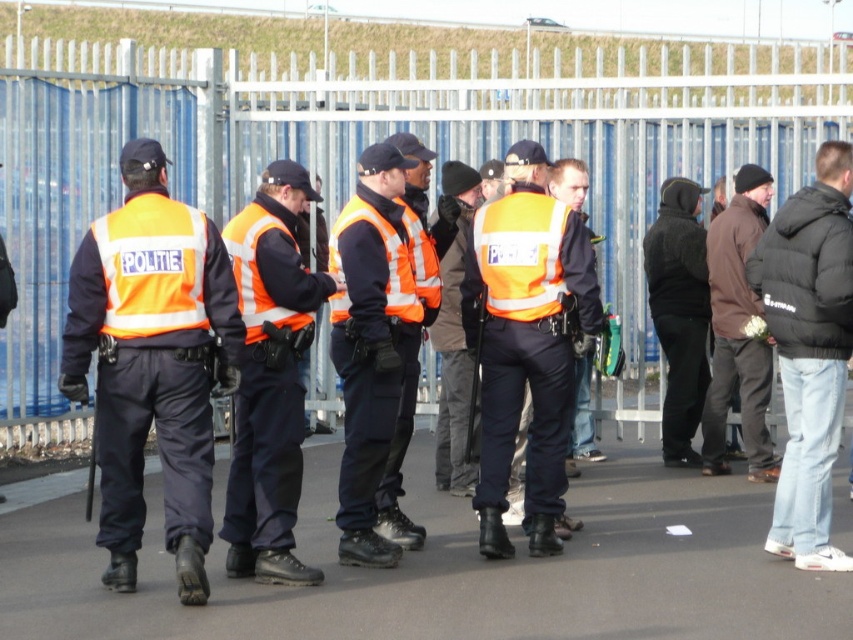
This screenshot has height=640, width=853. What do you see at coordinates (527, 342) in the screenshot?
I see `high-visibility reflective vest at center` at bounding box center [527, 342].

Which is in front, point (587, 285) or point (264, 225)?

Positioned in front is point (264, 225).

Locate an element on the screen. Image resolution: width=853 pixels, height=640 pixels. high-visibility reflective vest at center is located at coordinates (527, 342).

Is point (346, 444) positioned after point (717, 376)?

No.

Measure the distance between high-visibility fabric uniform at center and brown matte jacket at right.

high-visibility fabric uniform at center is 9.87 feet away from brown matte jacket at right.

You are a GUI agent. You are given a task and a screenshot of the screen. Output one action in this format:
    pyautogui.click(x=<x>, y=<y>)
    Task: Click on the high-visibility fabric uniform at center
    The height and width of the screenshot is (640, 853).
    Given the screenshot: What is the action you would take?
    pyautogui.click(x=372, y=340)

Is hi-visibility reflective vest at center bigger than black puffer jacket at right?

Indeed, hi-visibility reflective vest at center has a larger size compared to black puffer jacket at right.

Can you confirm if hi-visibility reflective vest at center is positioned to the right of black puffer jacket at right?

In fact, hi-visibility reflective vest at center is to the left of black puffer jacket at right.

Does point (286, 580) come farther from viewer compared to point (811, 520)?

No.

The height and width of the screenshot is (640, 853). I want to click on hi-visibility reflective vest at center, so click(x=270, y=378).